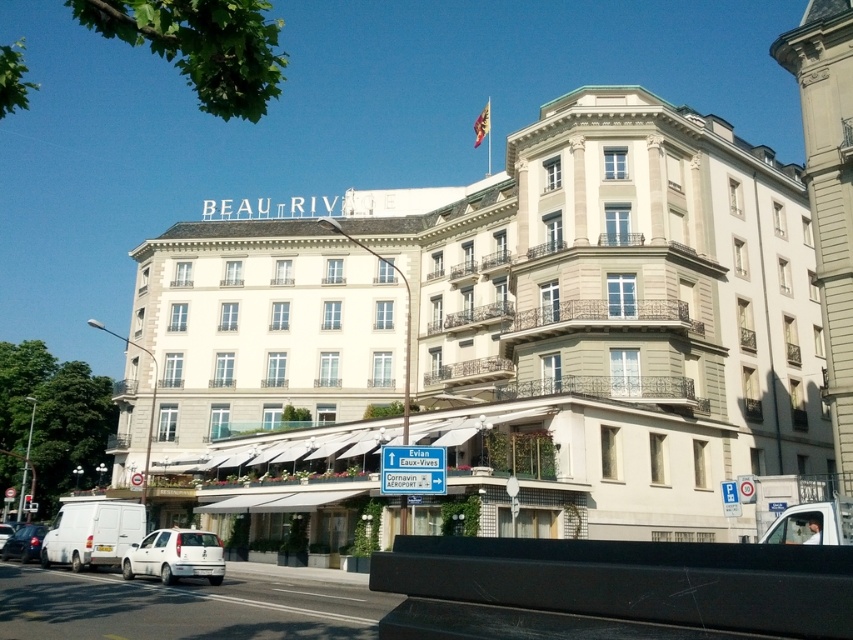
You are a delivery person trying to park your truck next to the white matte van at lower left and the silver metallic van at lower left. Which van takes up more space in the parking spot?

The white matte van at lower left has a greater width than the silver metallic van at lower left, so it occupies more space in the parking spot.

You are a delivery person who needs to park your white matte car at lower left as close as possible to the entrance of the white stone building at center without blocking the awnings. Based on the scene description, can you park your car in that spot?

The white stone building at center is positioned over the white matte car at lower left, meaning the car is parked directly in front of the building. Since the awnings are located in front of the building, parking the car there would block the awnings. Therefore, you cannot park the car in that spot without blocking the awnings.